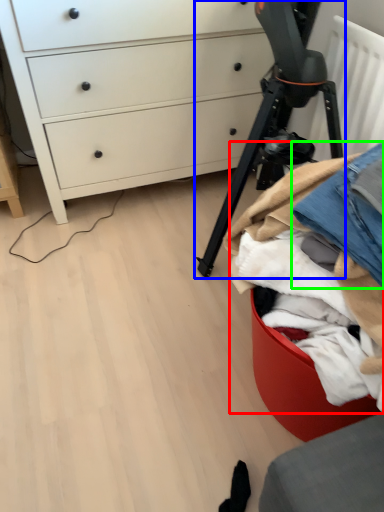
Question: Estimate the real-world distances between objects in this image. Which object is closer to clothing (highlighted by a red box), tripod (highlighted by a blue box) or jeans (highlighted by a green box)?

Choices:
 (A) tripod
 (B) jeans

Answer: (B)